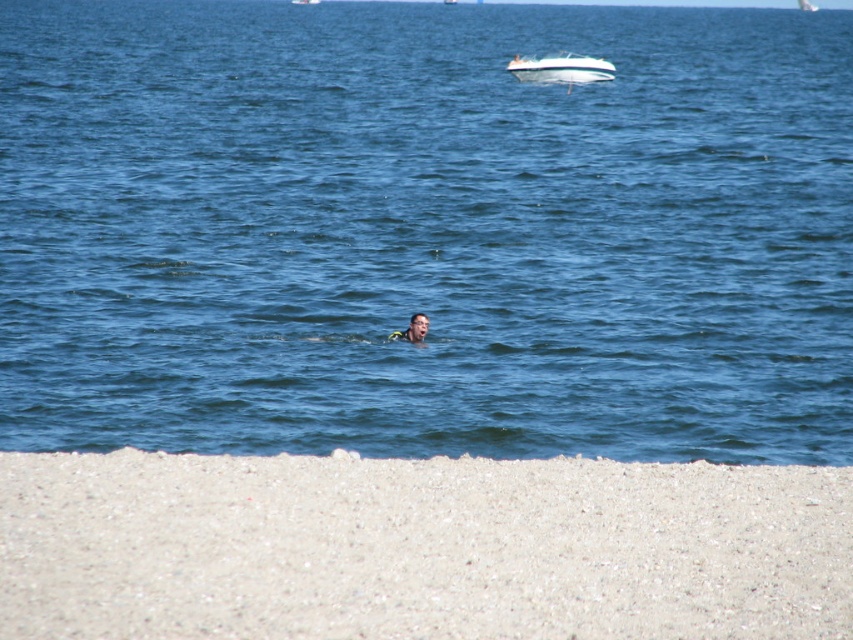
Question: Is white glossy boat at upper center to the left of smooth skin face at center from the viewer's perspective?

Choices:
 (A) yes
 (B) no

Answer: (B)

Question: Can you confirm if blue water at center is positioned below white glossy boat at upper center?

Choices:
 (A) no
 (B) yes

Answer: (A)

Question: Which object appears closest to the camera in this image?

Choices:
 (A) smooth skin face at center
 (B) white glossy boat at upper center
 (C) blue water at center
 (D) fine sand beach at lower center

Answer: (D)

Question: Which point is closer to the camera taking this photo?

Choices:
 (A) (532, 77)
 (B) (668, 566)
 (C) (590, 156)
 (D) (418, 326)

Answer: (B)

Question: Is fine sand beach at lower center above white glossy boat at upper center?

Choices:
 (A) yes
 (B) no

Answer: (B)

Question: Which point is farther from the camera taking this photo?

Choices:
 (A) (132, 596)
 (B) (415, 314)

Answer: (B)